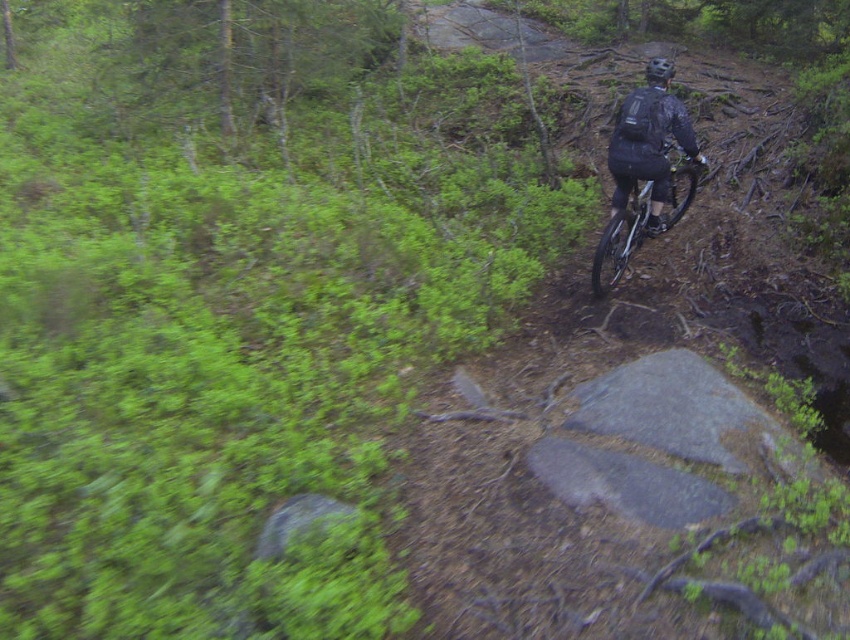
Does black matte jacket at upper right come behind matte black helmet at upper center?

No, it is in front of matte black helmet at upper center.

Where is `black matte jacket at upper right`? black matte jacket at upper right is located at coordinates pos(649,147).

Which is behind, point (616, 205) or point (656, 61)?

Positioned behind is point (616, 205).

I want to click on black matte jacket at upper right, so click(649, 147).

From the picture: Does black matte jacket at upper right have a lesser height compared to silver metallic bicycle at center?

Yes, black matte jacket at upper right is shorter than silver metallic bicycle at center.

Is black matte jacket at upper right bigger than silver metallic bicycle at center?

Incorrect, black matte jacket at upper right is not larger than silver metallic bicycle at center.

Does point (670, 104) come behind point (615, 257)?

No.

The width and height of the screenshot is (850, 640). Find the location of `black matte jacket at upper right`. black matte jacket at upper right is located at coordinates (649, 147).

Who is lower down, silver metallic bicycle at center or matte black helmet at upper center?

Positioned lower is silver metallic bicycle at center.

Which is behind, point (596, 250) or point (654, 56)?

The point (654, 56) is behind.

Does point (690, 168) come farther from viewer compared to point (655, 68)?

Yes, point (690, 168) is behind point (655, 68).

The height and width of the screenshot is (640, 850). What are the coordinates of `silver metallic bicycle at center` in the screenshot? It's located at (621, 240).